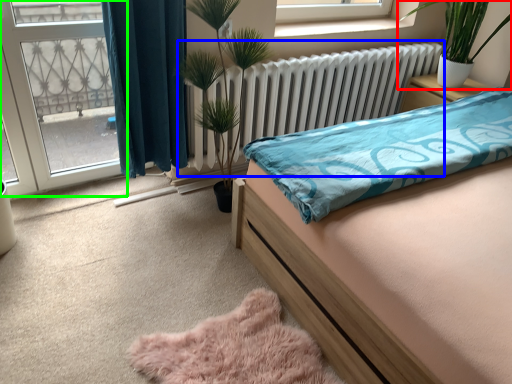
Question: Estimate the real-world distances between objects in this image. Which object is farther from houseplant (highlighted by a red box), radiator (highlighted by a blue box) or glass door (highlighted by a green box)?

Choices:
 (A) radiator
 (B) glass door

Answer: (B)